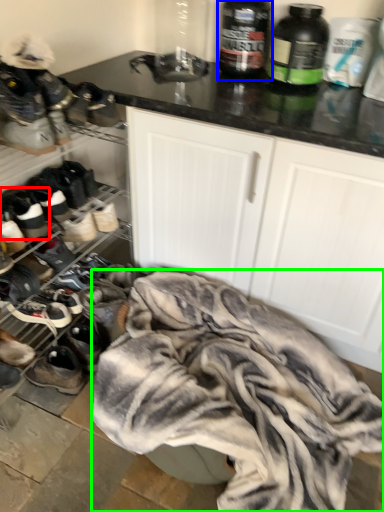
Question: Which object is the farthest from footwear (highlighted by a red box)? Choose among these: bottle (highlighted by a blue box) or clothing (highlighted by a green box).

Choices:
 (A) bottle
 (B) clothing

Answer: (A)